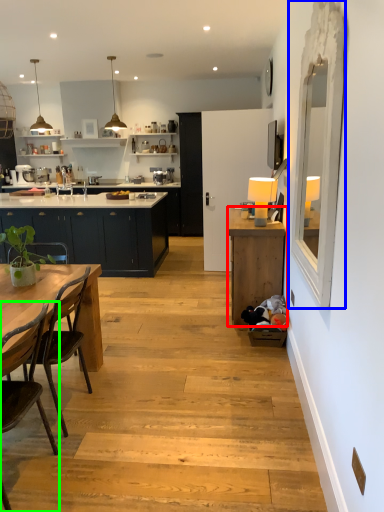
Question: Which is farther away from cabinetry (highlighted by a red box)? glass door (highlighted by a blue box) or chair (highlighted by a green box)?

Choices:
 (A) glass door
 (B) chair

Answer: (B)